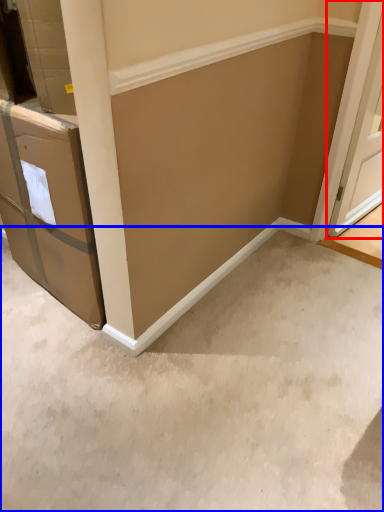
Question: Among these objects, which one is nearest to the camera, door (highlighted by a red box) or concrete (highlighted by a blue box)?

Choices:
 (A) door
 (B) concrete

Answer: (B)